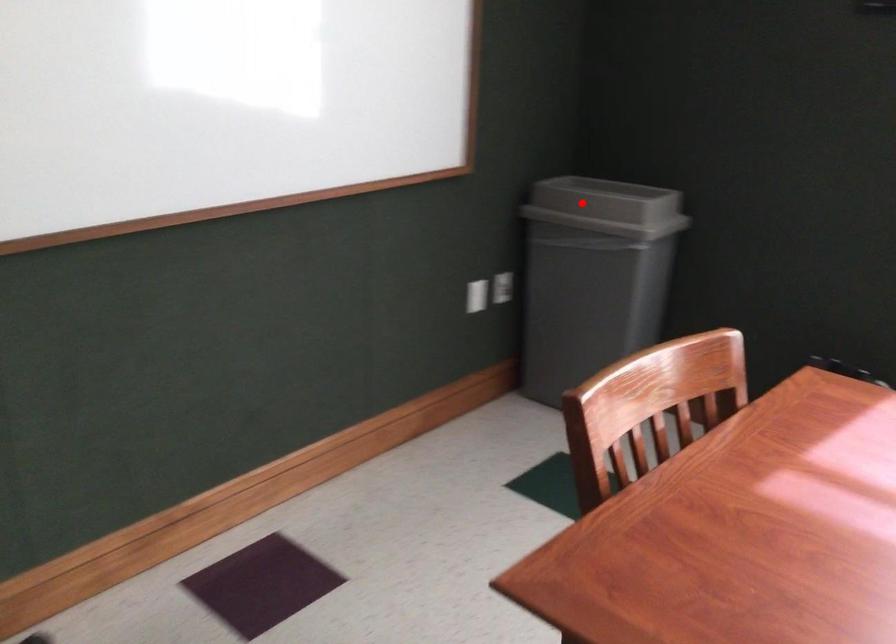
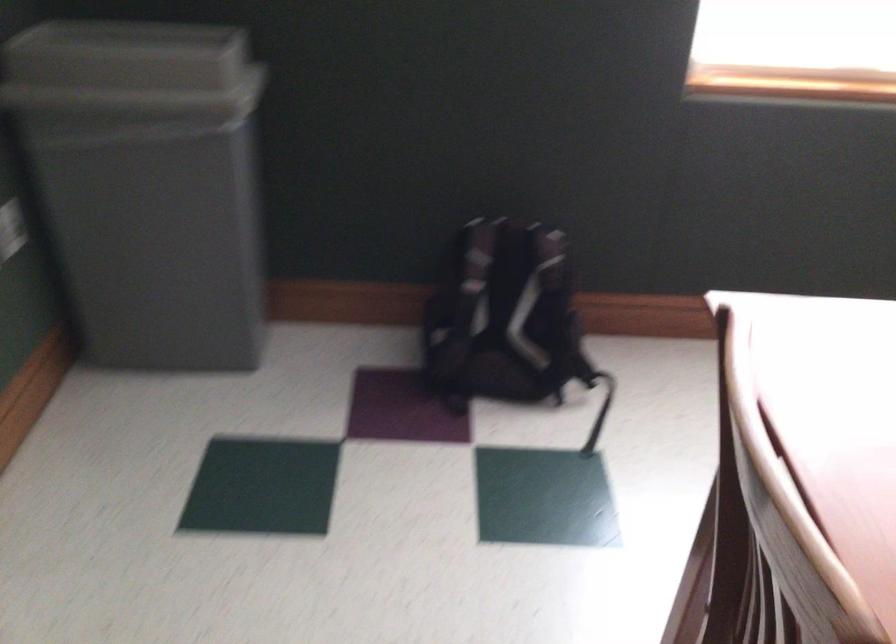
Question: I am providing you with two images of the same scene from different viewpoints. Image1 has a red point marked. In image2, the corresponding 3D location appears at what relative position? Reply with the corresponding letter.

Choices:
 (A) Closer
 (B) Farther

Answer: (A)